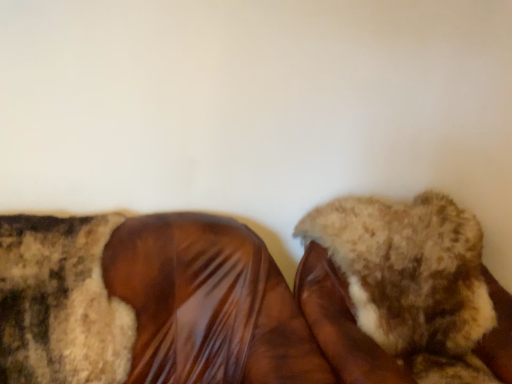
Question: Is there a large distance between fuzzy fabric shoe at center, which is the 1th footwear in right-to-left order, and shiny brown shoe at center, positioned as the 2th footwear in right-to-left order?

Choices:
 (A) no
 (B) yes

Answer: (A)

Question: Is fuzzy fabric shoe at center, which is the 1th footwear in right-to-left order, at the right side of shiny brown shoe at center, positioned as the 2th footwear in right-to-left order?

Choices:
 (A) no
 (B) yes

Answer: (B)

Question: Could you tell me if fuzzy fabric shoe at center, which is the 1th footwear in right-to-left order, is turned towards shiny brown shoe at center, which is counted as the first footwear, starting from the left?

Choices:
 (A) yes
 (B) no

Answer: (B)

Question: Is fuzzy fabric shoe at center, which is the 1th footwear in right-to-left order, bigger than shiny brown shoe at center, which is counted as the first footwear, starting from the left?

Choices:
 (A) no
 (B) yes

Answer: (A)

Question: From a real-world perspective, is fuzzy fabric shoe at center, positioned as the second footwear in left-to-right order, on shiny brown shoe at center, positioned as the 2th footwear in right-to-left order?

Choices:
 (A) yes
 (B) no

Answer: (A)

Question: Is fuzzy fabric shoe at center, positioned as the second footwear in left-to-right order, behind shiny brown shoe at center, positioned as the 2th footwear in right-to-left order?

Choices:
 (A) yes
 (B) no

Answer: (A)

Question: From a real-world perspective, is shiny brown shoe at center, positioned as the 2th footwear in right-to-left order, under fuzzy fabric shoe at center, which is the 1th footwear in right-to-left order?

Choices:
 (A) yes
 (B) no

Answer: (A)

Question: Does shiny brown shoe at center, which is counted as the first footwear, starting from the left, have a lesser height compared to fuzzy fabric shoe at center, which is the 1th footwear in right-to-left order?

Choices:
 (A) no
 (B) yes

Answer: (A)

Question: From the image's perspective, is shiny brown shoe at center, which is counted as the first footwear, starting from the left, under fuzzy fabric shoe at center, which is the 1th footwear in right-to-left order?

Choices:
 (A) yes
 (B) no

Answer: (A)

Question: Is shiny brown shoe at center, positioned as the 2th footwear in right-to-left order, at the right side of fuzzy fabric shoe at center, positioned as the second footwear in left-to-right order?

Choices:
 (A) yes
 (B) no

Answer: (B)

Question: Can you confirm if shiny brown shoe at center, which is counted as the first footwear, starting from the left, is smaller than fuzzy fabric shoe at center, which is the 1th footwear in right-to-left order?

Choices:
 (A) yes
 (B) no

Answer: (B)

Question: Can you confirm if shiny brown shoe at center, positioned as the 2th footwear in right-to-left order, is bigger than fuzzy fabric shoe at center, positioned as the second footwear in left-to-right order?

Choices:
 (A) yes
 (B) no

Answer: (A)

Question: Considering the positions of shiny brown shoe at center, which is counted as the first footwear, starting from the left, and fuzzy fabric shoe at center, which is the 1th footwear in right-to-left order, in the image, is shiny brown shoe at center, which is counted as the first footwear, starting from the left, taller or shorter than fuzzy fabric shoe at center, which is the 1th footwear in right-to-left order,?

Choices:
 (A) tall
 (B) short

Answer: (A)